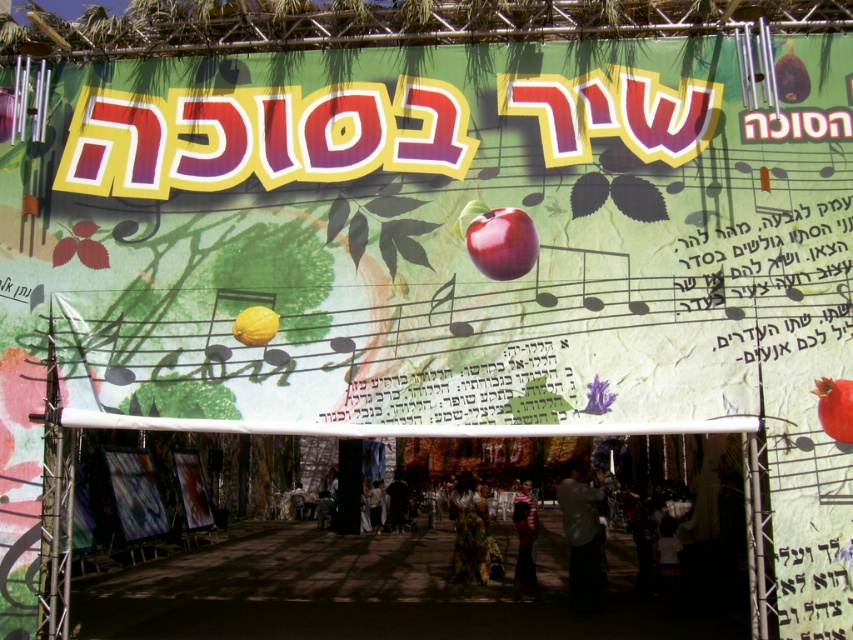
Which is below, striped sweater at center or yellow matte lemon at left?

striped sweater at center is below.

Does point (531, 573) come closer to viewer compared to point (274, 321)?

That is False.

Is point (521, 516) farther from viewer compared to point (256, 326)?

Yes, point (521, 516) is behind point (256, 326).

Where is `striped sweater at center`? striped sweater at center is located at coordinates (524, 540).

Can you confirm if shiny red apple at center is shorter than dark fabric person at center?

Yes.

Does shiny red apple at center appear on the left side of dark fabric person at center?

No, shiny red apple at center is not to the left of dark fabric person at center.

Image resolution: width=853 pixels, height=640 pixels. What are the coordinates of `shiny red apple at center` in the screenshot? It's located at (502, 243).

Can you confirm if pomegranate at center is positioned above yellow matte lemon at left?

No.

Between pomegranate at center and yellow matte lemon at left, which one has less height?

Standing shorter between the two is yellow matte lemon at left.

Image resolution: width=853 pixels, height=640 pixels. What do you see at coordinates (834, 406) in the screenshot?
I see `pomegranate at center` at bounding box center [834, 406].

The width and height of the screenshot is (853, 640). Find the location of `pomegranate at center`. pomegranate at center is located at coordinates (834, 406).